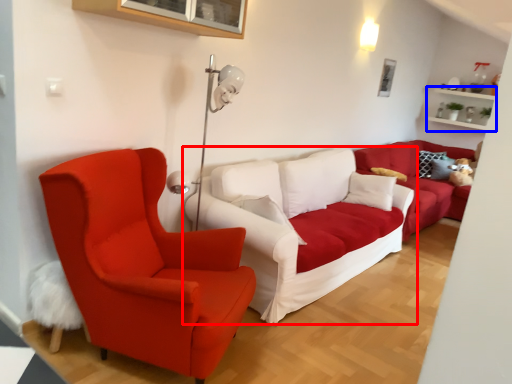
Question: Which of the following is the farthest to the observer, studio couch (highlighted by a red box) or shelf (highlighted by a blue box)?

Choices:
 (A) studio couch
 (B) shelf

Answer: (B)